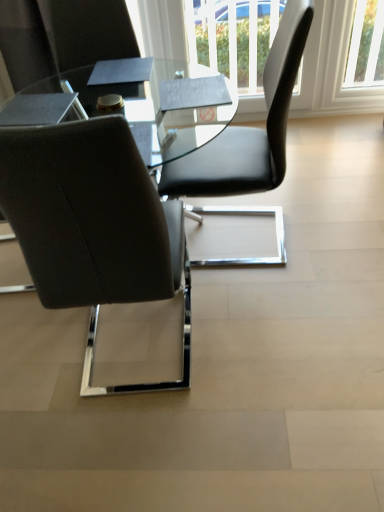
This screenshot has width=384, height=512. What are the coordinates of `free spot below matte black chair at left, the 2th chair from the right (from a real-world perspective)` in the screenshot? It's located at (139, 353).